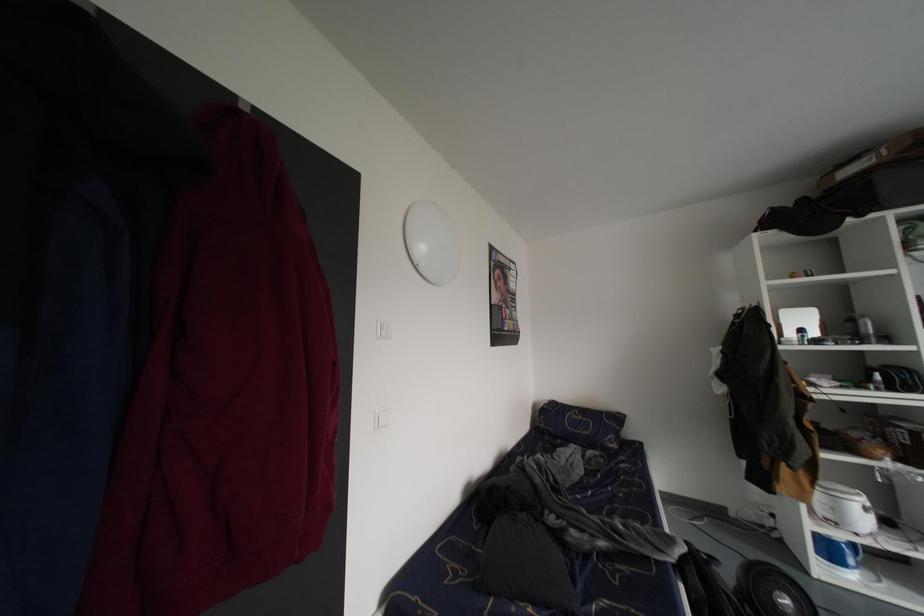
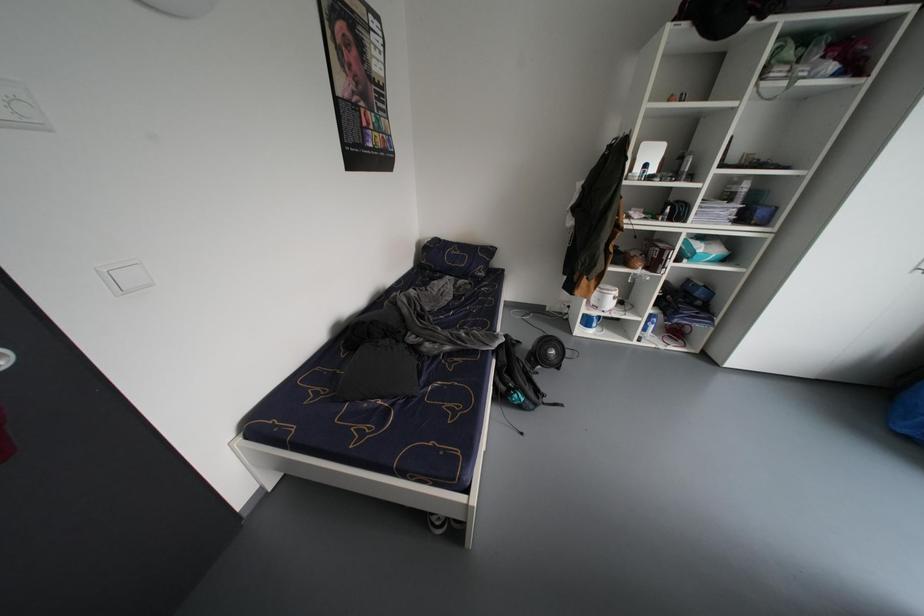
The first image is from the beginning of the video and the second image is from the end. How did the camera likely rotate when shooting the video?

The camera's rotation is toward right-down.